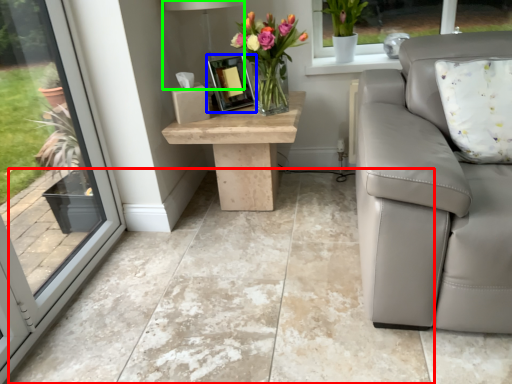
Question: Considering the real-world distances, which object is farthest from concrete (highlighted by a red box)? picture frame (highlighted by a blue box) or lamp (highlighted by a green box)?

Choices:
 (A) picture frame
 (B) lamp

Answer: (B)